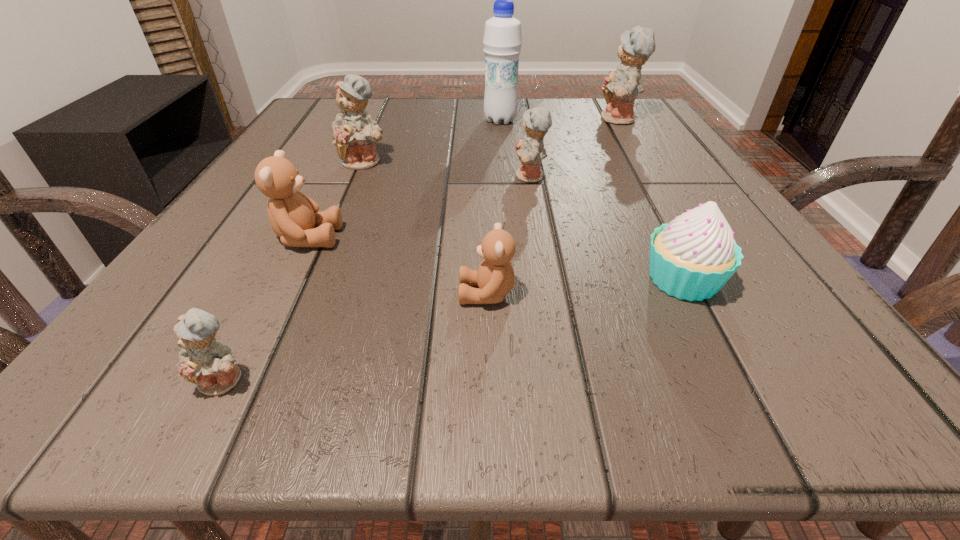
This screenshot has width=960, height=540. Identify the location of white cupcake. (692, 257).

The image size is (960, 540). Find the location of `the fifth farthest teddy bear`. the fifth farthest teddy bear is located at coordinates (495, 277).

Locate an element on the screen. the nearer brown teddy bear is located at coordinates (495, 277).

Image resolution: width=960 pixels, height=540 pixels. Identify the location of the smallest blue teddy bear. 208,364.

In order to click on the nearest teddy bear in this screenshot , I will do `click(208, 364)`.

What are the coordinates of `vacant area situated on the right of the tallest object` in the screenshot? It's located at (551, 120).

You are a GUI agent. You are given a task and a screenshot of the screen. Output one action in this format:
    pyautogui.click(x=<x>, y=<y>)
    Task: Click on the free spot located on the front-facing side of the rightmost blue teddy bear
    This screenshot has width=960, height=540.
    Given the screenshot: What is the action you would take?
    pyautogui.click(x=482, y=120)

You are a GUI agent. You are given a task and a screenshot of the screen. Output one action in this format:
    pyautogui.click(x=<x>, y=<y>)
    Task: Click on the free spot located 0.070m on the front-facing side of the rightmost blue teddy bear
    The image size is (960, 540).
    Given the screenshot: What is the action you would take?
    pyautogui.click(x=566, y=120)

Image resolution: width=960 pixels, height=540 pixels. What are the coordinates of `blank area located on the front-facing side of the rightmost blue teddy bear` in the screenshot? It's located at (487, 120).

I want to click on free region located on the front-facing side of the second tallest teddy bear, so click(x=338, y=224).